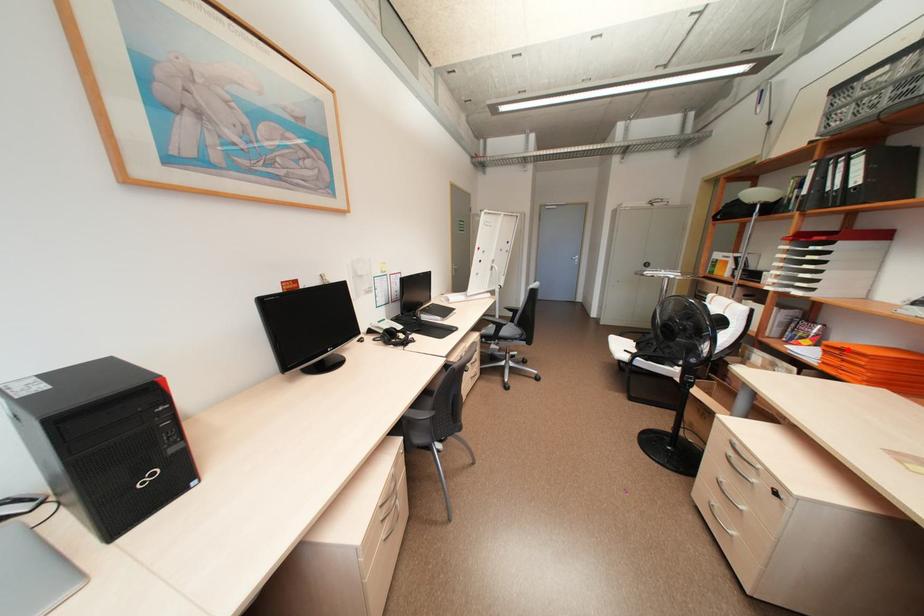
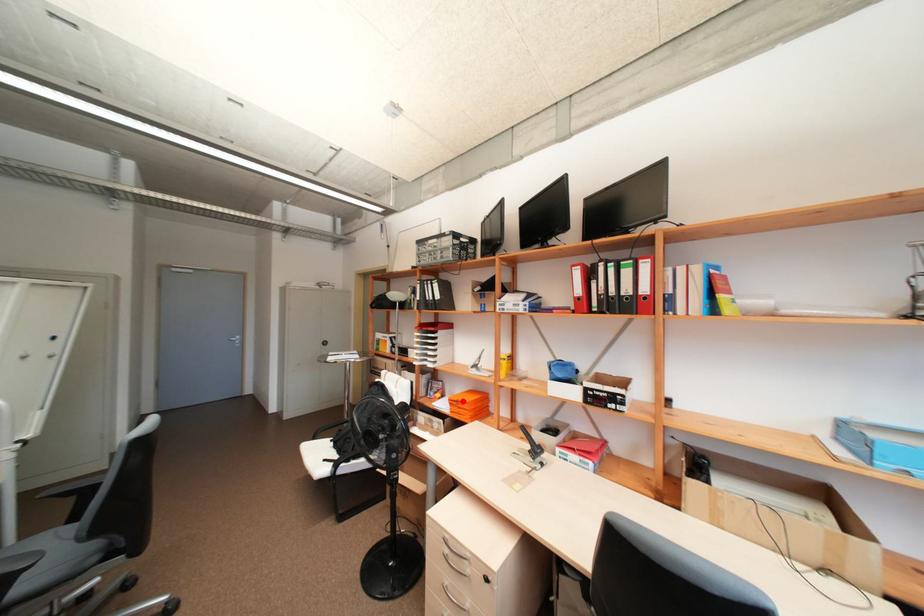
I am providing you with two images of the same scene from different viewpoints. A red point is marked on the first image and another point is marked on the second image. Does the point marked in image1 correspond to the same location as the one in image2?

Yes